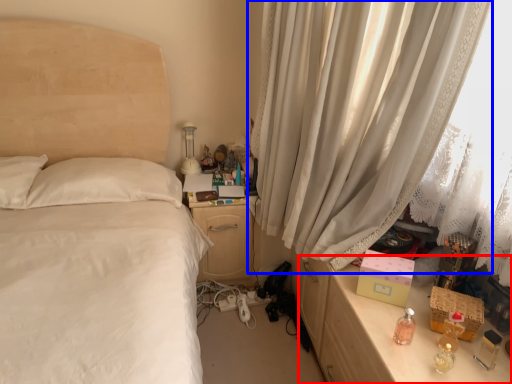
Question: Which object is closer to the camera taking this photo, vanity (highlighted by a red box) or curtain (highlighted by a blue box)?

Choices:
 (A) vanity
 (B) curtain

Answer: (B)